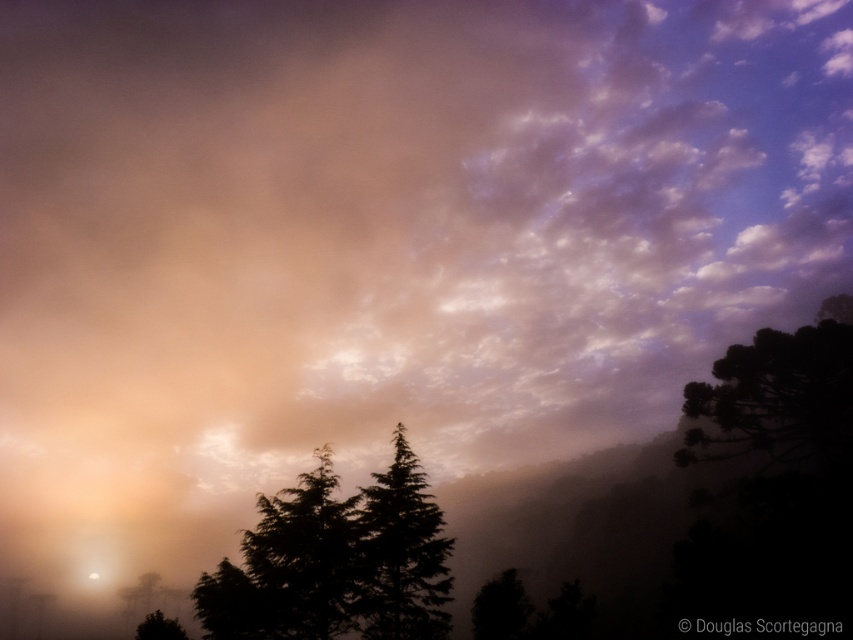
You are standing at the camera position observing the dramatic sky scene. There is a point marked at coordinates point (782, 362). Can you estimate how far this point is from your current position?

The point (782, 362) is 203.15 feet away from the camera, so the distance is approximately 203.15 feet.